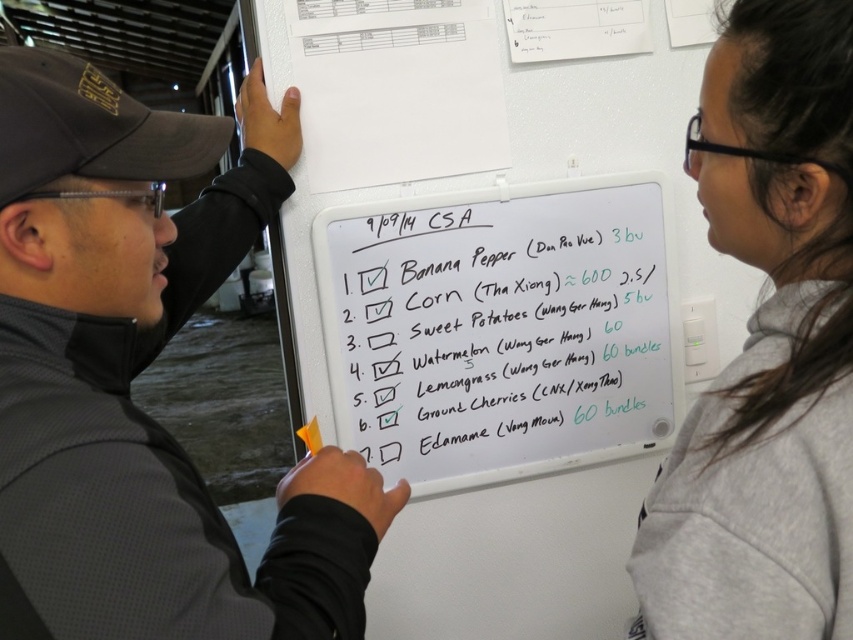
Looking at this image, how far apart are black matte jacket at left and whiteboard at center?

black matte jacket at left is 43.95 centimeters away from whiteboard at center.

Who is positioned more to the right, black matte jacket at left or whiteboard at center?

whiteboard at center is more to the right.

At what (x,y) coordinates should I click in order to perform the action: click on black matte jacket at left. Please return your answer as a coordinate pair (x, y). Looking at the image, I should click on (138, 372).

Looking at this image, can you confirm if whiteboard at center is positioned to the left of orange matte highlighter at center?

No, whiteboard at center is not to the left of orange matte highlighter at center.

Who is higher up, whiteboard at center or orange matte highlighter at center?

A: whiteboard at center is higher up.

Where is `whiteboard at center`? whiteboard at center is located at coordinates (502, 330).

At what (x,y) coordinates should I click in order to perform the action: click on whiteboard at center. Please return your answer as a coordinate pair (x, y). The width and height of the screenshot is (853, 640). Looking at the image, I should click on (502, 330).

Between black matte jacket at left and orange matte highlighter at center, which one appears on the right side from the viewer's perspective?

From the viewer's perspective, orange matte highlighter at center appears more on the right side.

Between black matte jacket at left and orange matte highlighter at center, which one has more height?

black matte jacket at left is taller.

Who is more distant from viewer, (140, 349) or (312, 428)?

The point (312, 428) is more distant.

Find the location of `black matte jacket at left`. black matte jacket at left is located at coordinates (138, 372).